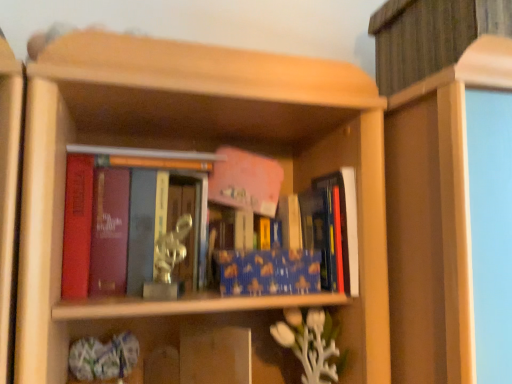
Identify the location of metallic silver statue at center. (192, 225).

Find the location of `book below the metallic silver statue at center (from a real-world perspective)`. book below the metallic silver statue at center (from a real-world perspective) is located at coordinates click(x=269, y=272).

Is metallic silver statue at center oriented towards blue glossy book at center, the first book when ordered from right to left?

No, metallic silver statue at center is not aimed at blue glossy book at center, the first book when ordered from right to left.

Is metallic silver statue at center wider or thinner than blue glossy book at center, which ranks as the second book in left-to-right order?

In the image, metallic silver statue at center appears to be wider than blue glossy book at center, which ranks as the second book in left-to-right order.

Does point (168, 207) come in front of point (244, 265)?

No, it is behind (244, 265).

From a real-world perspective, is metallic silver statue at center physically located above or below metallic statue at center, the second book when ordered from right to left?

In terms of real-world spatial position, metallic silver statue at center is below metallic statue at center, the second book when ordered from right to left.

Is metallic statue at center, the second book when ordered from right to left, at the back of metallic silver statue at center?

Yes, metallic silver statue at center is facing away from metallic statue at center, the second book when ordered from right to left.

Is point (192, 198) positioned in front of point (353, 255)?

No.

Locate an element on the screen. Image resolution: width=512 pixels, height=384 pixels. book below the metallic statue at center, arranged as the 1th book when viewed from the left (from a real-world perspective) is located at coordinates (269, 272).

Is blue glossy book at center, which ranks as the second book in left-to-right order, with metallic statue at center, the second book when ordered from right to left?

No, blue glossy book at center, which ranks as the second book in left-to-right order, is not touching metallic statue at center, the second book when ordered from right to left.

From a real-world perspective, between blue glossy book at center, the first book when ordered from right to left, and metallic statue at center, the second book when ordered from right to left, who is vertically lower?

blue glossy book at center, the first book when ordered from right to left, is physically lower.

Measure the distance between blue glossy book at center, the first book when ordered from right to left, and metallic statue at center, arranged as the 1th book when viewed from the left.

4.81 inches.

Measure the distance from metallic statue at center, the second book when ordered from right to left, to metallic silver statue at center.

metallic statue at center, the second book when ordered from right to left, is 4.32 inches from metallic silver statue at center.

In terms of height, does metallic statue at center, the second book when ordered from right to left, look taller or shorter compared to metallic silver statue at center?

metallic statue at center, the second book when ordered from right to left, is taller than metallic silver statue at center.

Is point (213, 178) positioned after point (170, 221)?

Yes, point (213, 178) is farther from viewer.

Which object is positioned more to the right, metallic statue at center, the second book when ordered from right to left, or metallic silver statue at center?

Positioned to the right is metallic silver statue at center.

From a real-world perspective, is blue glossy book at center, which ranks as the second book in left-to-right order, below metallic silver statue at center?

Indeed, from a real-world perspective, blue glossy book at center, which ranks as the second book in left-to-right order, is positioned beneath metallic silver statue at center.

Considering the relative positions of blue glossy book at center, the first book when ordered from right to left, and metallic silver statue at center in the image provided, is blue glossy book at center, the first book when ordered from right to left, to the right of metallic silver statue at center from the viewer's perspective?

Correct, you'll find blue glossy book at center, the first book when ordered from right to left, to the right of metallic silver statue at center.

Is blue glossy book at center, the first book when ordered from right to left, spatially inside metallic silver statue at center, or outside of it?

blue glossy book at center, the first book when ordered from right to left, is located beyond the bounds of metallic silver statue at center.

In the scene shown: Which object is more forward, blue glossy book at center, which ranks as the second book in left-to-right order, or metallic silver statue at center?

metallic silver statue at center is more forward.

Are metallic statue at center, arranged as the 1th book when viewed from the left, and blue glossy book at center, which ranks as the second book in left-to-right order, located far from each other?

metallic statue at center, arranged as the 1th book when viewed from the left, is near blue glossy book at center, which ranks as the second book in left-to-right order, not far away.

From the image's perspective, is metallic statue at center, arranged as the 1th book when viewed from the left, located above blue glossy book at center, the first book when ordered from right to left?

Yes, from the image's perspective, metallic statue at center, arranged as the 1th book when viewed from the left, is over blue glossy book at center, the first book when ordered from right to left.

Is blue glossy book at center, which ranks as the second book in left-to-right order, completely or partially inside metallic statue at center, the second book when ordered from right to left?

No, blue glossy book at center, which ranks as the second book in left-to-right order, is not a part of metallic statue at center, the second book when ordered from right to left.

Is metallic statue at center, the second book when ordered from right to left, thinner than blue glossy book at center, which ranks as the second book in left-to-right order?

No.

Where is `glass door located in front of the blue glossy book at center, the first book when ordered from right to left`? The image size is (512, 384). glass door located in front of the blue glossy book at center, the first book when ordered from right to left is located at coordinates (192, 225).

The height and width of the screenshot is (384, 512). In order to click on glass door that appears below the metallic statue at center, the second book when ordered from right to left (from a real-world perspective) in this screenshot , I will do (x=192, y=225).

When comparing their distances from metallic statue at center, arranged as the 1th book when viewed from the left, does blue glossy book at center, which ranks as the second book in left-to-right order, or metallic silver statue at center seem further?

blue glossy book at center, which ranks as the second book in left-to-right order, lies further to metallic statue at center, arranged as the 1th book when viewed from the left, than the other object.

Which object lies further to the anchor point blue glossy book at center, which ranks as the second book in left-to-right order, metallic silver statue at center or metallic statue at center, the second book when ordered from right to left?

metallic silver statue at center is further to blue glossy book at center, which ranks as the second book in left-to-right order.

Looking at the image, which one is located further to metallic silver statue at center, metallic statue at center, arranged as the 1th book when viewed from the left, or blue glossy book at center, the first book when ordered from right to left?

blue glossy book at center, the first book when ordered from right to left, lies further to metallic silver statue at center than the other object.

Estimate the real-world distances between objects in this image. Which object is further from metallic statue at center, arranged as the 1th book when viewed from the left, metallic silver statue at center or blue glossy book at center, the first book when ordered from right to left?

blue glossy book at center, the first book when ordered from right to left, is further to metallic statue at center, arranged as the 1th book when viewed from the left.

Based on their spatial positions, is metallic statue at center, the second book when ordered from right to left, or metallic silver statue at center closer to blue glossy book at center, which ranks as the second book in left-to-right order?

Based on the image, metallic statue at center, the second book when ordered from right to left, appears to be nearer to blue glossy book at center, which ranks as the second book in left-to-right order.

Estimate the real-world distances between objects in this image. Which object is closer to metallic silver statue at center, blue glossy book at center, which ranks as the second book in left-to-right order, or metallic statue at center, the second book when ordered from right to left?

metallic statue at center, the second book when ordered from right to left, is positioned closer to the anchor metallic silver statue at center.

Find the location of a particular element. glass door between metallic statue at center, arranged as the 1th book when viewed from the left, and blue glossy book at center, the first book when ordered from right to left, from left to right is located at coordinates (192, 225).